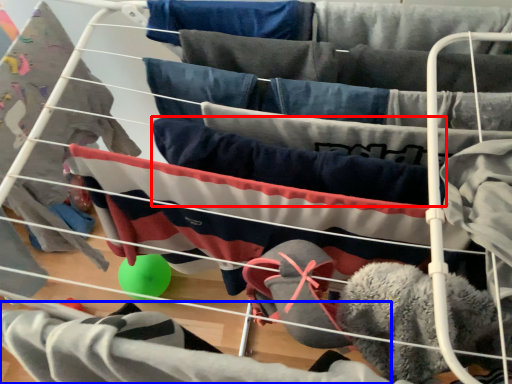
Question: Which object is closer to the camera taking this photo, clothing (highlighted by a red box) or clothing (highlighted by a blue box)?

Choices:
 (A) clothing
 (B) clothing

Answer: (B)